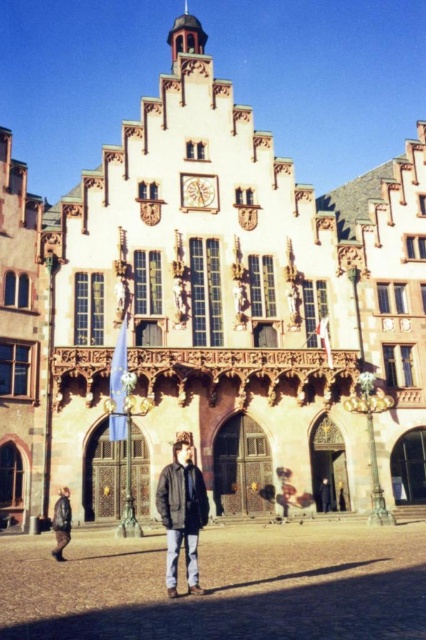
Question: Can you confirm if dark brown leather jacket at center is positioned to the left of dark brown leather jacket at lower left?

Choices:
 (A) yes
 (B) no

Answer: (B)

Question: Which object appears closest to the camera in this image?

Choices:
 (A) wooden carved clock at center
 (B) dark brown stone building at left
 (C) dark brown leather jacket at lower left

Answer: (C)

Question: Which point is farther to the camera?

Choices:
 (A) dark brown leather jacket at center
 (B) dark brown leather jacket at lower left
 (C) dark gray jacket at center

Answer: (C)

Question: Considering the relative positions of dark brown leather jacket at center and dark brown leather jacket at lower left in the image provided, where is dark brown leather jacket at center located with respect to dark brown leather jacket at lower left?

Choices:
 (A) left
 (B) right

Answer: (B)

Question: Does dark brown leather jacket at center appear under wooden carved clock at center?

Choices:
 (A) no
 (B) yes

Answer: (B)

Question: Estimate the real-world distances between objects in this image. Which object is closer to the dark brown stone building at left?

Choices:
 (A) wooden carved clock at center
 (B) dark brown leather jacket at lower left
 (C) dark gray jacket at center
 (D) dark brown leather jacket at center

Answer: (B)